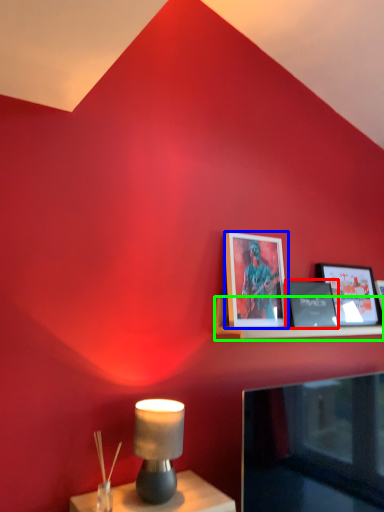
Question: Which object is positioned farthest from picture frame (highlighted by a red box)? Select from picture frame (highlighted by a blue box) and shelf (highlighted by a green box).

Choices:
 (A) picture frame
 (B) shelf

Answer: (A)